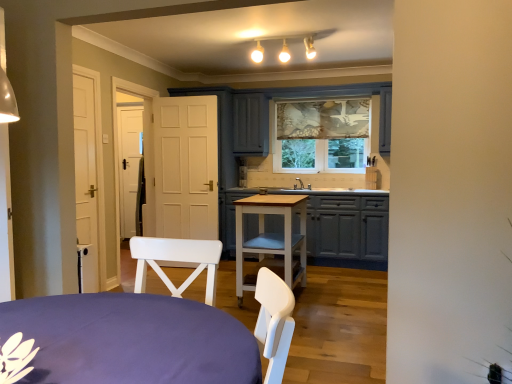
Question: Is point (249, 203) closer or farther from the camera than point (44, 365)?

Choices:
 (A) farther
 (B) closer

Answer: (A)

Question: From the image's perspective, relative to purple fabric-covered table at lower left, marked as the 1th table in a front-to-back arrangement, is light brown wooden table at center, arranged as the 2th table when viewed from the front, above or below?

Choices:
 (A) above
 (B) below

Answer: (A)

Question: Which of these objects is positioned farthest from the purple fabric-covered table at lower left, which is the 2th table from back to front?

Choices:
 (A) patterned fabric window at center
 (B) light brown wooden table at center, arranged as the 2th table when viewed from the front
 (C) matte gray cabinets at center

Answer: (A)

Question: Which of these objects is positioned farthest from the purple fabric-covered table at lower left, which is the 2th table from back to front?

Choices:
 (A) patterned fabric window at center
 (B) matte gray cabinets at center
 (C) light brown wooden table at center, arranged as the 2th table when viewed from the front

Answer: (A)